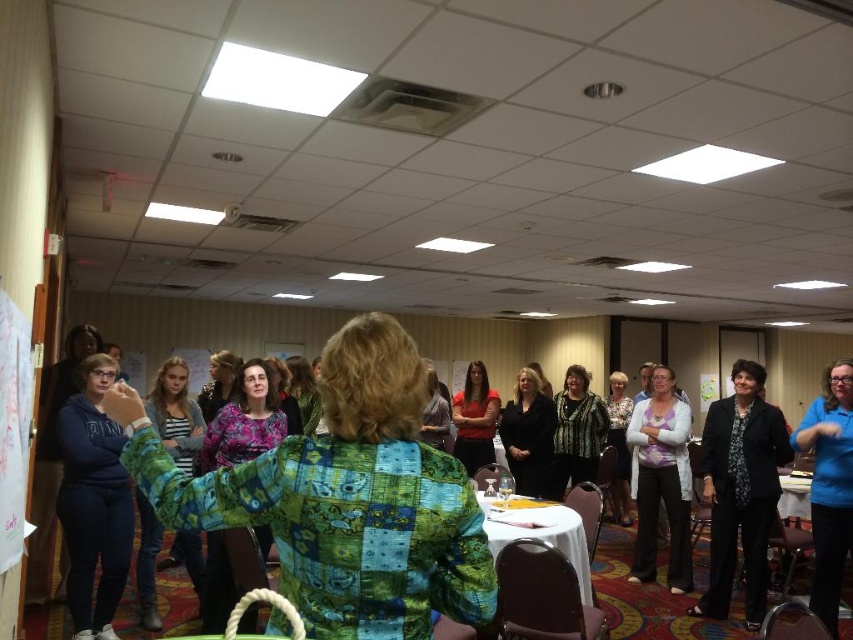
You are organizing a photo shoot and need to arrange two outfits for a catalog. The outfits are the striped fabric shirt at left and the floral blouse at center. Based on the scene description, which outfit takes up more space when displayed?

The floral blouse at center takes up more space than the striped fabric shirt at left because the striped fabric shirt at left occupies less space than floral blouse at center.

You are standing in the conference room and want to place a small object on the table. You have two points marked on the table surface. The first point is at coordinate point(653, 545) and the second point is at coordinate point(532, 516). Which point is closer to you when you are facing the table?

Point(653, 545) is closer to you than point(532, 516) because it is further to the camera, meaning it is nearer to your position when facing the table.